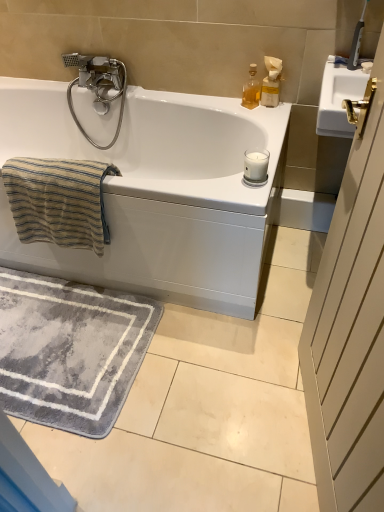
What are the coordinates of `blank space above gray plush bath mat at lower left (from a real-world perspective)` in the screenshot? It's located at (61, 347).